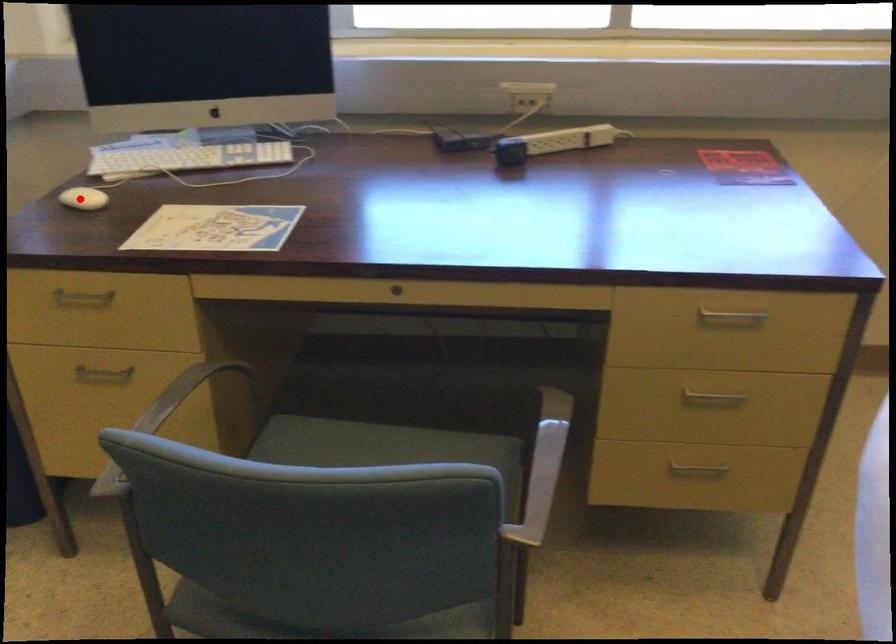
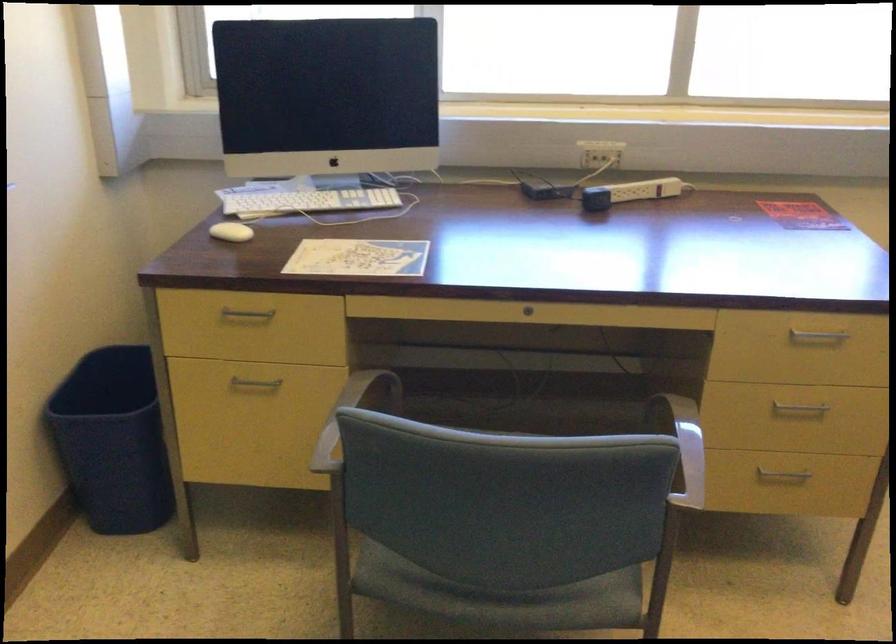
The point at the highlighted location is marked in the first image. Where is the corresponding point in the second image?

(230, 232)